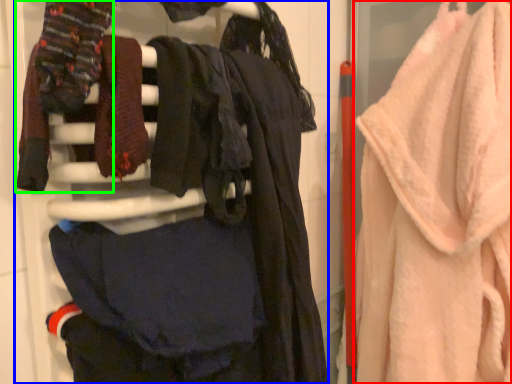
Question: Which object is the farthest from towel (highlighted by a red box)? Choose among these: closet (highlighted by a blue box) or clothing (highlighted by a green box).

Choices:
 (A) closet
 (B) clothing

Answer: (B)